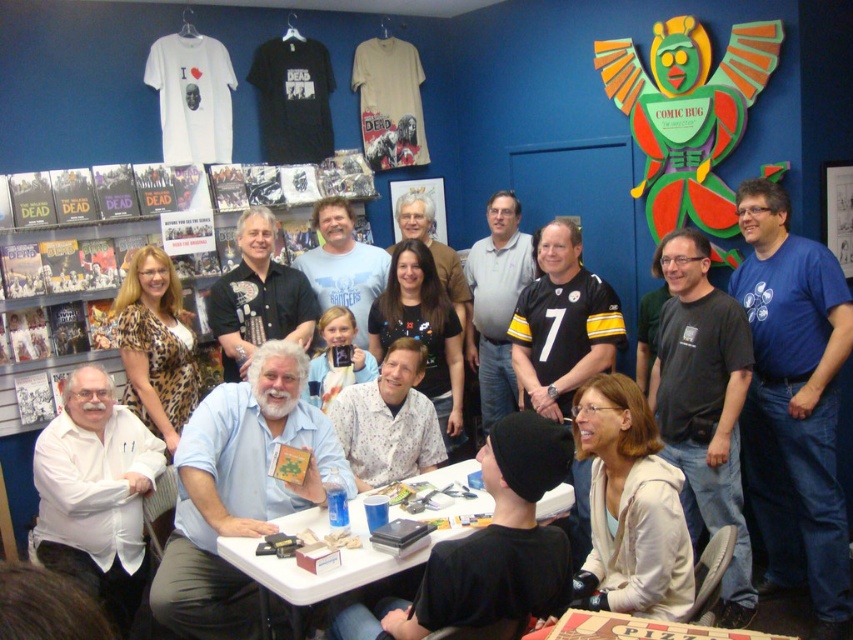
Question: Among these points, which one is nearest to the camera?

Choices:
 (A) (347, 292)
 (B) (602, 412)
 (C) (167, 256)
 (D) (398, 468)

Answer: (B)

Question: Can you confirm if white printed shirt at center is thinner than black leather shirt at center?

Choices:
 (A) yes
 (B) no

Answer: (A)

Question: Among these points, which one is nearest to the camera?

Choices:
 (A) (148, 330)
 (B) (688, 588)
 (C) (729, 570)

Answer: (B)

Question: Is black matte shirt at center wider than light blue t-shirt at center?

Choices:
 (A) yes
 (B) no

Answer: (B)

Question: Can you confirm if white matte jacket at lower right is positioned below light blue t-shirt at center?

Choices:
 (A) yes
 (B) no

Answer: (A)

Question: Which of the following is the closest to the observer?

Choices:
 (A) white matte jacket at lower right
 (B) blue cotton t-shirt at right
 (C) black matte shirt at center
 (D) light blue t-shirt at center

Answer: (A)